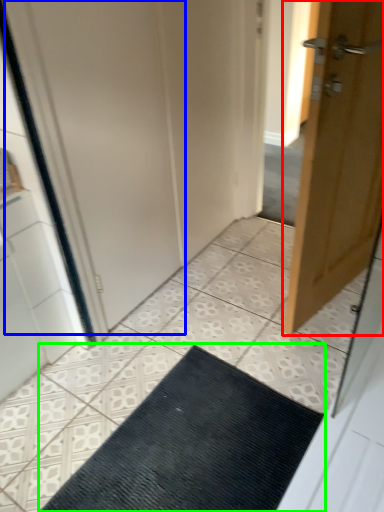
Question: Considering the real-world distances, which object is farthest from door (highlighted by a red box)? screen door (highlighted by a blue box) or doormat (highlighted by a green box)?

Choices:
 (A) screen door
 (B) doormat

Answer: (B)